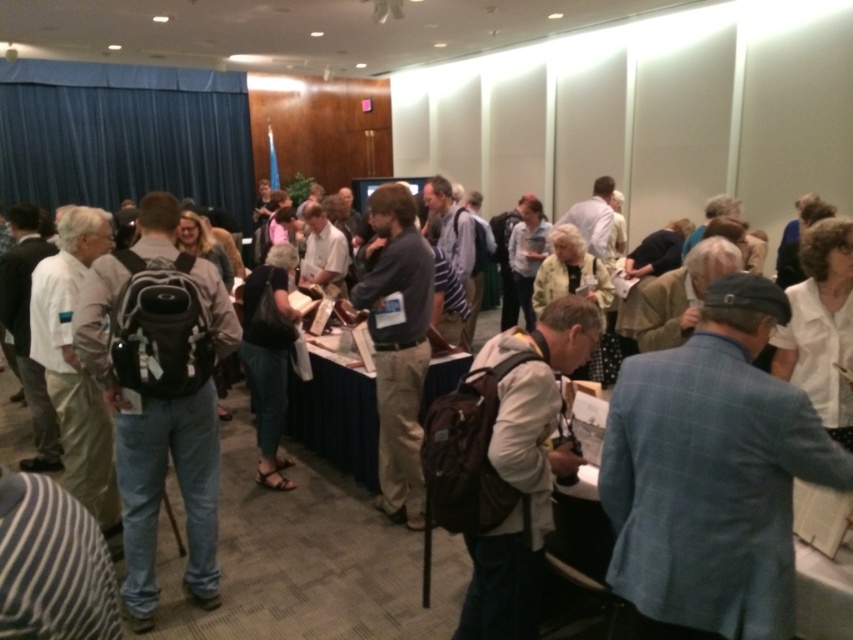
Question: Which point is closer to the camera?

Choices:
 (A) white cotton shirt at center
 (B) dark gray sweater at center

Answer: (A)

Question: Can you confirm if blue plaid blazer at center is smaller than white cotton shirt at center?

Choices:
 (A) no
 (B) yes

Answer: (B)

Question: Among these objects, which one is nearest to the camera?

Choices:
 (A) white cotton shirt at center
 (B) blue plaid blazer at center
 (C) dark gray sweater at center

Answer: (B)

Question: Which point is farther to the camera?

Choices:
 (A) dark gray sweater at center
 (B) white cotton shirt at center
 (C) matte black backpack at center
 (D) blue plaid blazer at center

Answer: (A)

Question: Can you confirm if matte black backpack at center is positioned below white cotton shirt at center?

Choices:
 (A) no
 (B) yes

Answer: (A)

Question: Does matte black backpack at center have a larger size compared to dark gray sweater at center?

Choices:
 (A) yes
 (B) no

Answer: (A)